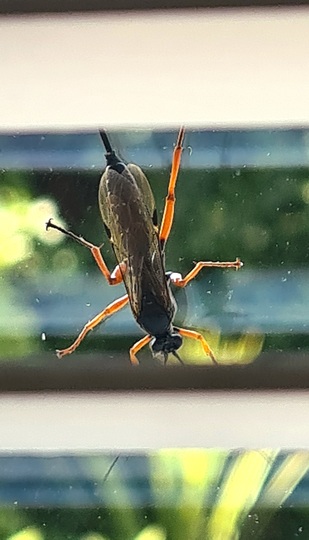
Identify the location of window. click(x=274, y=251).